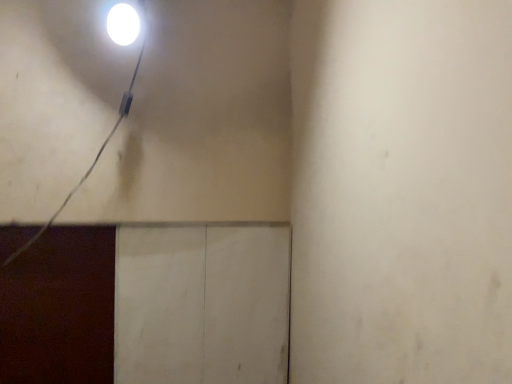
The height and width of the screenshot is (384, 512). What do you see at coordinates (123, 24) in the screenshot?
I see `white glossy light at upper left` at bounding box center [123, 24].

Locate an element on the screen. This screenshot has height=384, width=512. white glossy light at upper left is located at coordinates (123, 24).

What are the coordinates of `white glossy light at upper left` in the screenshot? It's located at (123, 24).